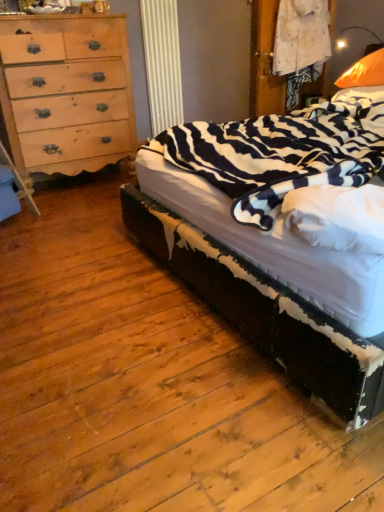
Question: Can you confirm if zebra-patterned fabric bed at right is shorter than light brown wood chest of drawers at left?

Choices:
 (A) yes
 (B) no

Answer: (A)

Question: From a real-world perspective, is zebra-patterned fabric bed at right below light brown wood chest of drawers at left?

Choices:
 (A) yes
 (B) no

Answer: (A)

Question: Is zebra-patterned fabric bed at right not inside light brown wood chest of drawers at left?

Choices:
 (A) no
 (B) yes

Answer: (B)

Question: Can you confirm if zebra-patterned fabric bed at right is positioned to the left of light brown wood chest of drawers at left?

Choices:
 (A) yes
 (B) no

Answer: (B)

Question: From the image's perspective, does zebra-patterned fabric bed at right appear higher than light brown wood chest of drawers at left?

Choices:
 (A) no
 (B) yes

Answer: (A)

Question: Are zebra-patterned fabric bed at right and light brown wood chest of drawers at left making contact?

Choices:
 (A) yes
 (B) no

Answer: (B)

Question: Is zebra-patterned fabric bed at right positioned behind orange fabric pillow at upper right?

Choices:
 (A) no
 (B) yes

Answer: (A)

Question: From a real-world perspective, is zebra-patterned fabric bed at right located beneath orange fabric pillow at upper right?

Choices:
 (A) no
 (B) yes

Answer: (B)

Question: Does zebra-patterned fabric bed at right appear on the left side of orange fabric pillow at upper right?

Choices:
 (A) yes
 (B) no

Answer: (A)

Question: Is orange fabric pillow at upper right at the back of zebra-patterned fabric bed at right?

Choices:
 (A) yes
 (B) no

Answer: (A)

Question: Would you say zebra-patterned fabric bed at right contains orange fabric pillow at upper right?

Choices:
 (A) yes
 (B) no

Answer: (A)

Question: Is zebra-patterned fabric bed at right not within orange fabric pillow at upper right?

Choices:
 (A) yes
 (B) no

Answer: (A)

Question: Considering the relative sizes of orange fabric pillow at upper right and zebra-patterned fabric bed at right in the image provided, is orange fabric pillow at upper right shorter than zebra-patterned fabric bed at right?

Choices:
 (A) yes
 (B) no

Answer: (A)